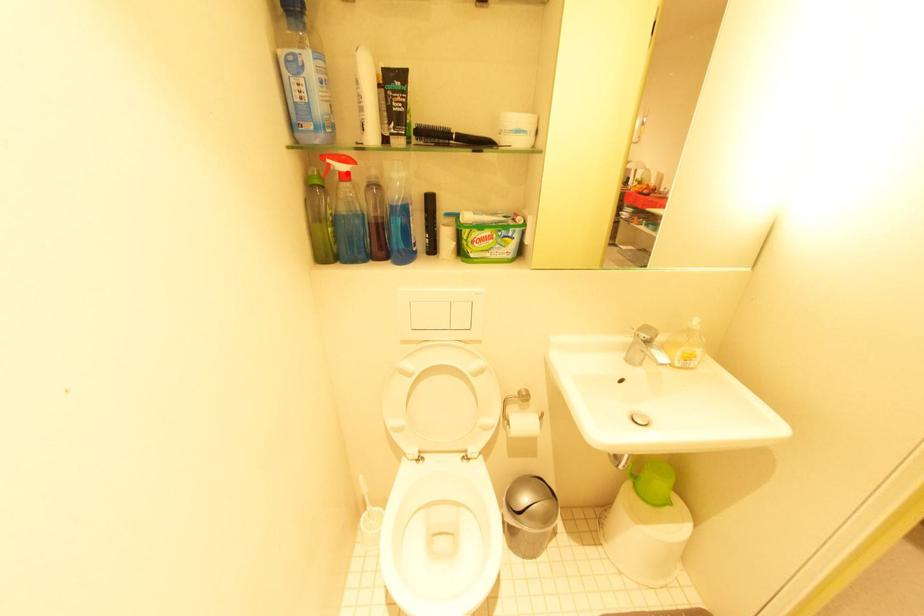
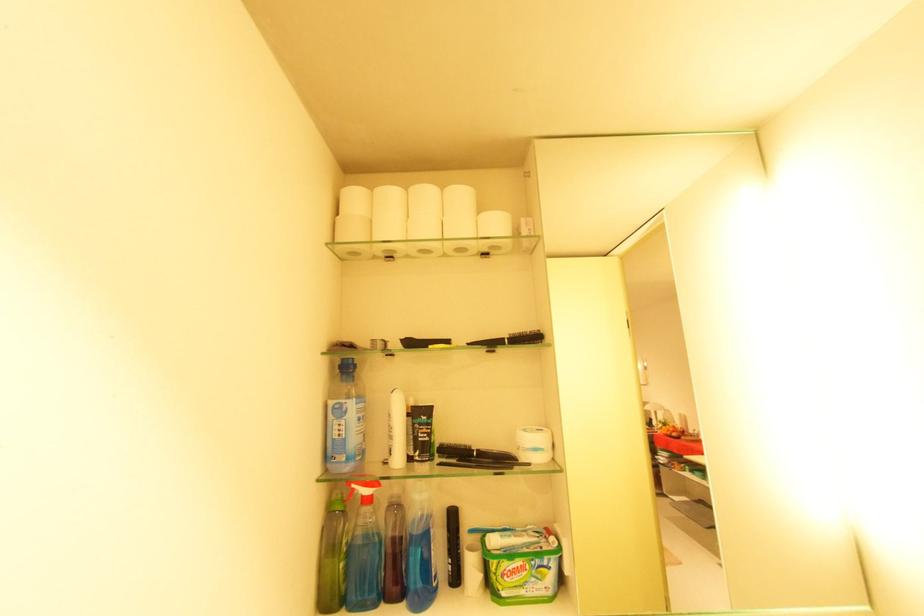
Locate, in the second image, the point that corresponds to the highlighted location in the first image.

(370, 496)